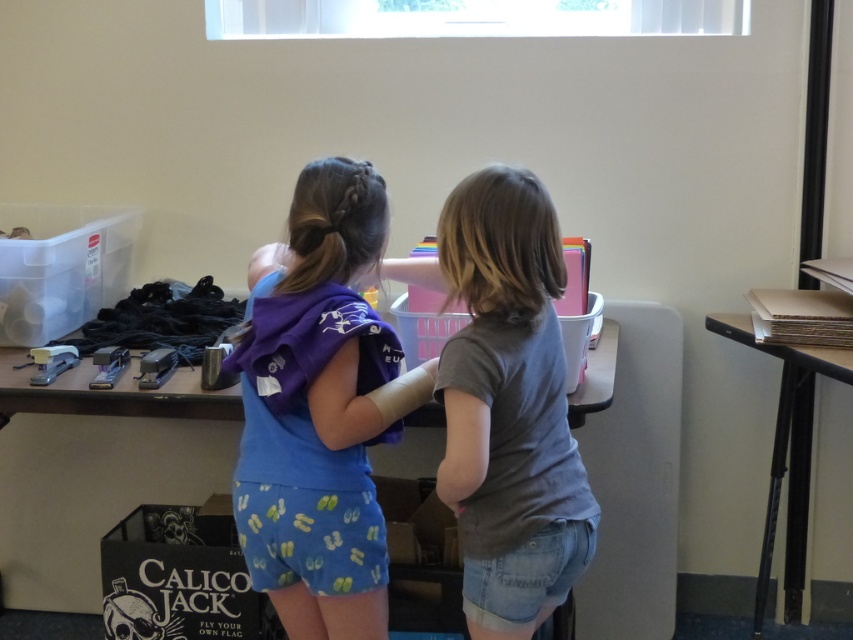
You are a delivery person who needs to place a small package on the table. The table has limited space. Which object, the blue cotton shirt at center or the smooth cardboard stack at right, should you move to make room?

The blue cotton shirt at center is much taller than the smooth cardboard stack at right, so moving the smooth cardboard stack at right would free up more horizontal space for the package.

Based on the photo, you are a delivery person who needs to place a small package between the blue cotton shirt at center and the smooth cardboard stack at right. Can you fit the package in the space between them if the package requires 3.5 feet of space?

The blue cotton shirt at center and smooth cardboard stack at right are 4.25 feet apart from each other. Since the package requires 3.5 feet of space, there is enough space to fit the package between them.

You are a delivery person who needs to place a small package on the table. The gray matte shirt at center and the smooth cardboard stack at right are already on the table. Which object should you move to make space for the package?

You should move the gray matte shirt at center because it has a lesser height compared to the smooth cardboard stack at right, making it easier to move out of the way.